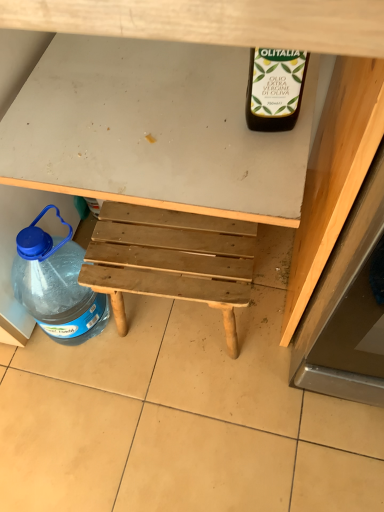
Question: From a real-world perspective, is wooden bench at center above or below transparent plastic bottle at lower left?

Choices:
 (A) above
 (B) below

Answer: (A)

Question: Considering the positions of wooden bench at center and transparent plastic bottle at lower left in the image, is wooden bench at center taller or shorter than transparent plastic bottle at lower left?

Choices:
 (A) tall
 (B) short

Answer: (A)

Question: Which of these objects is positioned closest to the transparent plastic bottle at lower left?

Choices:
 (A) wooden bench at center
 (B) natural wood stool at center

Answer: (B)

Question: Considering the real-world distances, which object is farthest from the wooden bench at center?

Choices:
 (A) transparent plastic bottle at lower left
 (B) natural wood stool at center

Answer: (A)